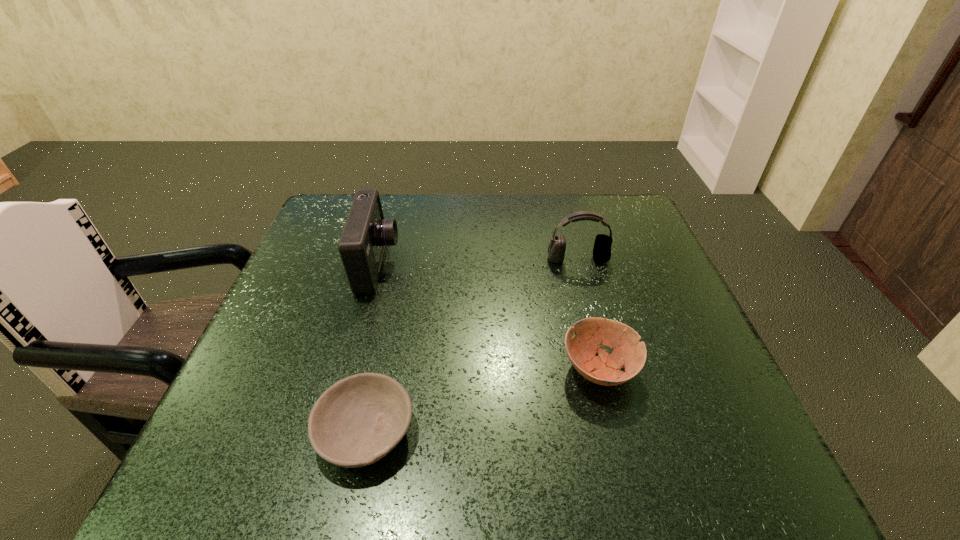
Locate an element on the screen. Image resolution: width=960 pixels, height=540 pixels. camera is located at coordinates (365, 234).

Find the location of `headset`. headset is located at coordinates pyautogui.click(x=602, y=246).

You are a GUI agent. You are given a task and a screenshot of the screen. Output one action in this format:
    pyautogui.click(x=<x>, y=<y>)
    Task: Click on the taller bowl
    The height and width of the screenshot is (540, 960).
    Given the screenshot: What is the action you would take?
    pyautogui.click(x=590, y=333)

Identify the location of the second shortest object. (590, 333).

I want to click on the shortest object, so click(x=357, y=421).

Identify the location of the shorter bowl. This screenshot has height=540, width=960. (357, 421).

Where is `vacant area located on the front-facing side of the camera`? This screenshot has width=960, height=540. vacant area located on the front-facing side of the camera is located at coordinates (419, 266).

Find the location of a particular element. vacant area located on the headband of the headset is located at coordinates (587, 292).

The image size is (960, 540). Find the location of `vacant space situated 0.140m on the right of the right bowl`. vacant space situated 0.140m on the right of the right bowl is located at coordinates (710, 369).

Where is `blank space located 0.370m on the right of the left bowl`? The height and width of the screenshot is (540, 960). blank space located 0.370m on the right of the left bowl is located at coordinates (631, 431).